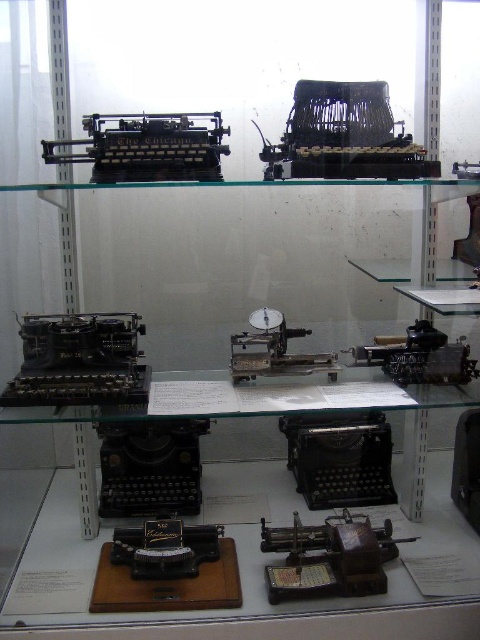
Between point (346, 134) and point (113, 156), which one is positioned behind?

The point (346, 134) is more distant.

Which of these two, matte black typewriter at upper center or black metal typewriter at upper left, stands taller?

Standing taller between the two is matte black typewriter at upper center.

Who is more distant from viewer, (402, 163) or (188, 164)?

Point (402, 163)

Locate an element on the screen. Image resolution: width=480 pixels, height=640 pixels. matte black typewriter at upper center is located at coordinates (344, 136).